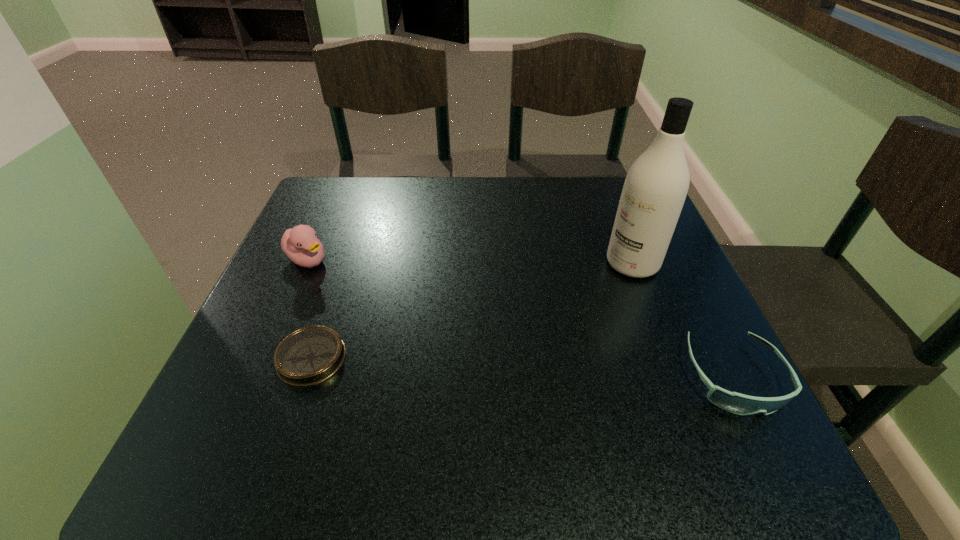
The image size is (960, 540). Find the location of `blank area located on the front-facing side of the second tallest object`. blank area located on the front-facing side of the second tallest object is located at coordinates (449, 342).

Locate an element on the screen. Image resolution: width=960 pixels, height=540 pixels. compass that is at the near edge is located at coordinates (310, 355).

At what (x,y) coordinates should I click in order to perform the action: click on goggles situated at the near edge. Please return your answer as a coordinate pair (x, y). Looking at the image, I should click on tap(737, 403).

I want to click on compass located at the left edge, so click(310, 355).

Identify the location of duckling that is at the left edge. (300, 244).

You are a GUI agent. You are given a task and a screenshot of the screen. Output one action in this format:
    pyautogui.click(x=<x>, y=<y>)
    Task: Click on the goggles located at the right edge
    This screenshot has width=960, height=540.
    Given the screenshot: What is the action you would take?
    pyautogui.click(x=737, y=403)

Where is `shampoo present at the right edge`? This screenshot has width=960, height=540. shampoo present at the right edge is located at coordinates (655, 188).

Locate an element on the screen. The width and height of the screenshot is (960, 540). object situated at the near left corner is located at coordinates (310, 355).

Locate an element on the screen. The width and height of the screenshot is (960, 540). object at the near right corner is located at coordinates (737, 403).

Find the location of a particular element. This screenshot has width=960, height=540. vacant space at the far edge of the desktop is located at coordinates (393, 192).